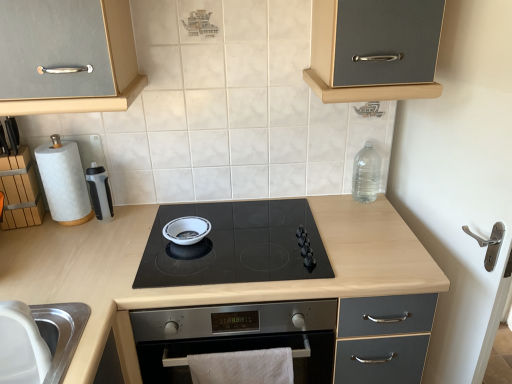
Find the location of `empty space that is ontop of light wood/black glass at center (from a real-world perspective)`. empty space that is ontop of light wood/black glass at center (from a real-world perspective) is located at coordinates (180, 251).